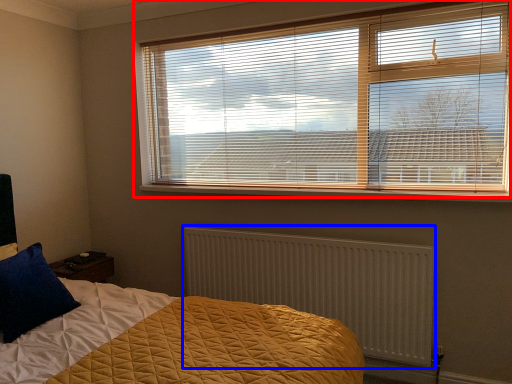
Question: Which object is further to the camera taking this photo, window blind (highlighted by a red box) or radiator (highlighted by a blue box)?

Choices:
 (A) window blind
 (B) radiator

Answer: (B)